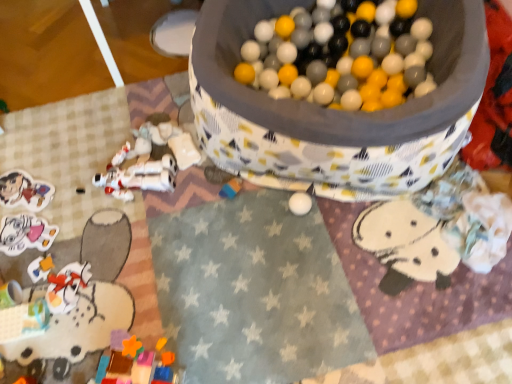
Where is `vacant area that is situated to the right of multicolored plastic blocks at center, acting as the 5th toy starting from the left`? This screenshot has height=384, width=512. vacant area that is situated to the right of multicolored plastic blocks at center, acting as the 5th toy starting from the left is located at coordinates (267, 207).